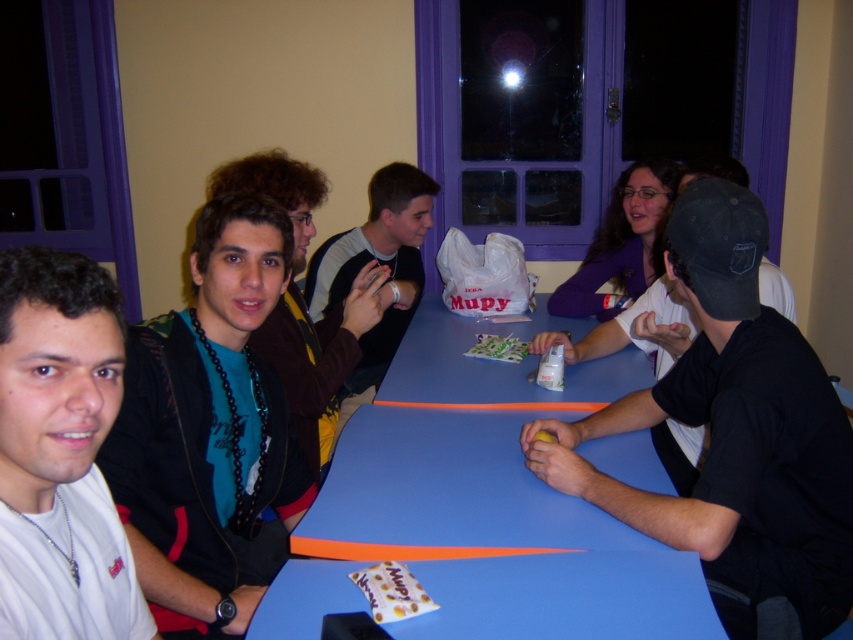
You are standing at the center of the table and want to place a gift card to the person wearing the black matte cap at right. Where should you aim to place the gift card so it reaches them directly?

The black matte cap at right is located at coordinates 0.683 on the x axis and 0.862 on the y axis, so place the gift card near those coordinates to reach them directly.

You are sitting at the blue plastic table at center and notice a teal matte shirt at center. Which object is positioned to the left of the other?

The teal matte shirt at center is to the left of the blue plastic table at center.